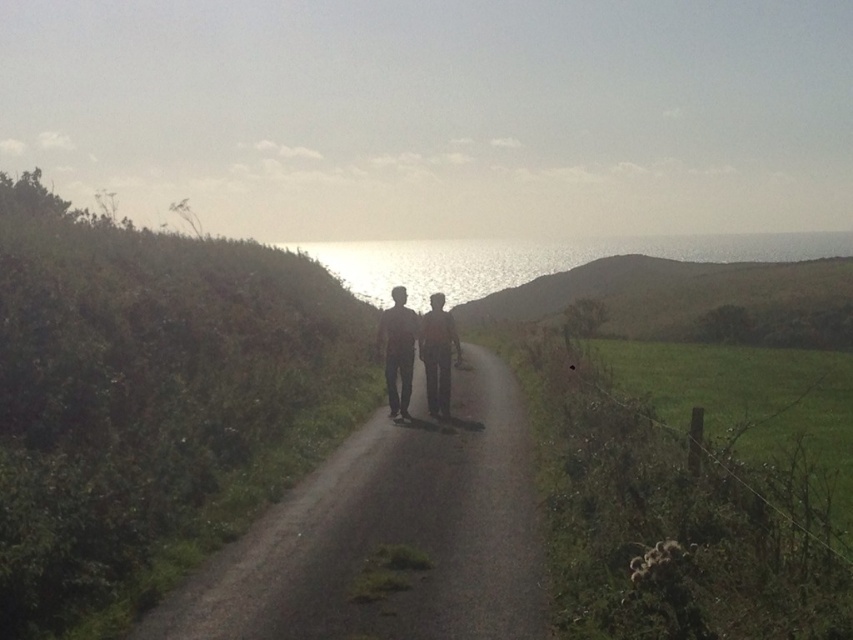
You are a hiker walking along the dirt path in the rural scene. You see two points marked on the path ahead of you. The first point is at coordinate point (252,557) and the second is at point (404,330). If you are facing the direction of the ocean, which point should you reach first?

Point (252,557) is in front of point (404,330), so you will reach point (252,557) first when moving towards the ocean.

You are a photographer trying to capture the two figures walking along the path. You want to ensure that the matte black pants at center and the dark brown leather jacket at center are both visible in your shot. Based on their positions, which object is closer to the left side of the frame?

The matte black pants at center is positioned on the left side of dark brown leather jacket at center, so the matte black pants at center is closer to the left side of the frame.